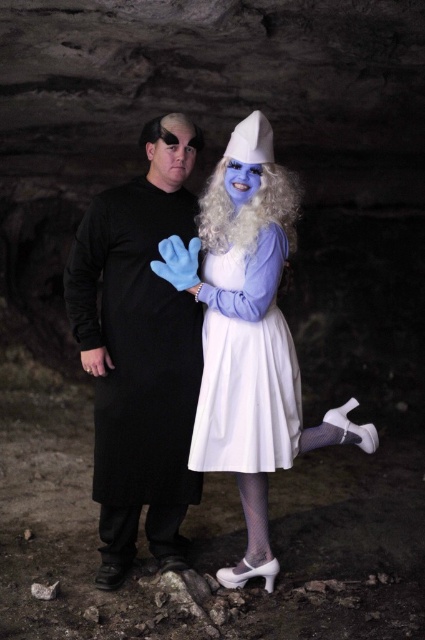
Can you confirm if white satin dress at center is smaller than white curly wig at center?

No, white satin dress at center is not smaller than white curly wig at center.

Between white satin dress at center and white curly wig at center, which one is positioned lower?

Positioned lower is white satin dress at center.

Is point (195, 417) positioned before point (246, 212)?

No, it is behind (246, 212).

Where is `white satin dress at center`? Image resolution: width=425 pixels, height=640 pixels. white satin dress at center is located at coordinates click(246, 364).

Is black matte coat at left behind white satin dress at center?

That is True.

Consider the image. Which of these two, black matte coat at left or white satin dress at center, stands taller?

With more height is black matte coat at left.

What do you see at coordinates (139, 352) in the screenshot? I see `black matte coat at left` at bounding box center [139, 352].

Where is `black matte coat at left`? This screenshot has width=425, height=640. black matte coat at left is located at coordinates (139, 352).

How far apart are matte blue dress at center and white curly wig at center?

A distance of 18.41 inches exists between matte blue dress at center and white curly wig at center.

From the picture: Is matte blue dress at center thinner than white curly wig at center?

Incorrect, matte blue dress at center's width is not less than white curly wig at center's.

Is point (150, 179) positioned before point (218, 236)?

No, (150, 179) is further to viewer.

Where is `matte blue dress at center`? matte blue dress at center is located at coordinates (248, 333).